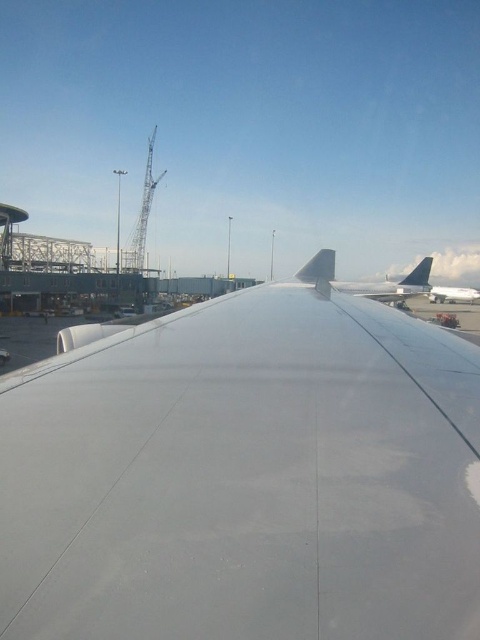
Question: From the image, what is the correct spatial relationship of white matte wing at center in relation to polished aluminum tail at upper right?

Choices:
 (A) below
 (B) above

Answer: (A)

Question: Which object appears farthest from the camera in this image?

Choices:
 (A) polished aluminum tail at upper right
 (B) matte white tail at center

Answer: (A)

Question: Can you confirm if white matte airplane at center is wider than polished aluminum tail at upper right?

Choices:
 (A) yes
 (B) no

Answer: (A)

Question: Among these points, which one is nearest to the camera?

Choices:
 (A) (420, 272)
 (B) (126, 611)
 (C) (332, 257)

Answer: (B)

Question: Which point is farther to the camera?

Choices:
 (A) white matte wing at center
 (B) matte white tail at center

Answer: (B)

Question: Does white matte wing at center appear on the right side of metallic silver airplane at center?

Choices:
 (A) no
 (B) yes

Answer: (A)